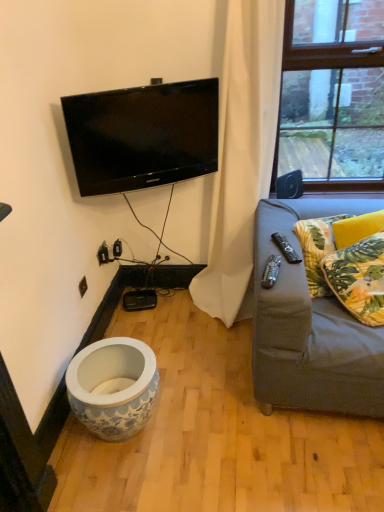
You are a GUI agent. You are given a task and a screenshot of the screen. Output one action in this format:
    pyautogui.click(x=<x>, y=<y>)
    Task: Click on the space that is in front of black plastic remote at right
    The height and width of the screenshot is (512, 384).
    Given the screenshot: What is the action you would take?
    pyautogui.click(x=284, y=267)